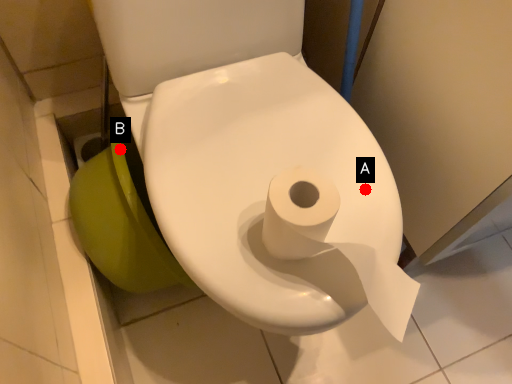
Question: Two points are circled on the image, labeled by A and B beside each circle. Which point is closer to the camera taking this photo?

Choices:
 (A) A is closer
 (B) B is closer

Answer: (A)